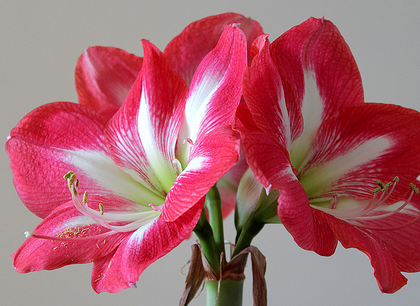
The image size is (420, 306). What are the coordinates of `wall` in the screenshot? It's located at (299, 296).